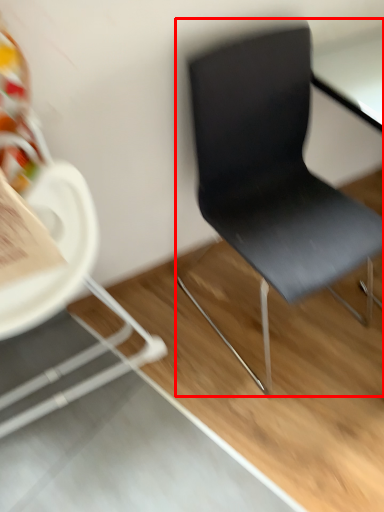
Question: From the image's perspective, what is the correct spatial positioning of chair (annotated by the red box) in reference to chair?

Choices:
 (A) below
 (B) above

Answer: (B)